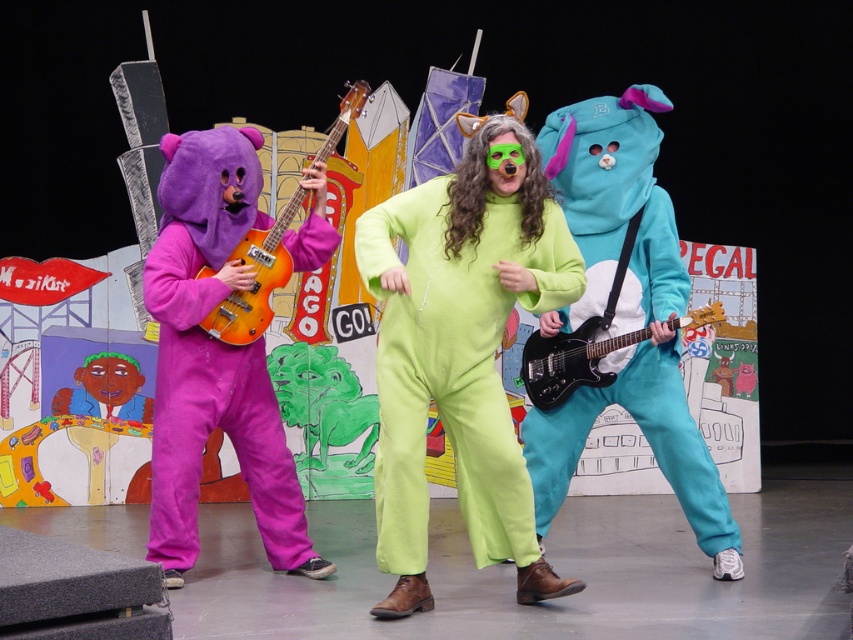
Question: Can you confirm if green fleece jumpsuit at center is positioned below purple fleece bear at left?

Choices:
 (A) yes
 (B) no

Answer: (A)

Question: Which point is closer to the camera?

Choices:
 (A) purple fleece bear at left
 (B) black glossy electric guitar at center
 (C) green fleece jumpsuit at center

Answer: (C)

Question: Which object is the farthest from the purple fleece bear at left?

Choices:
 (A) orange glossy guitar at left
 (B) black glossy electric guitar at center

Answer: (B)

Question: Can you confirm if green fleece jumpsuit at center is positioned to the left of purple fleece bear at left?

Choices:
 (A) no
 (B) yes

Answer: (A)

Question: Estimate the real-world distances between objects in this image. Which object is farther from the green fleece jumpsuit at center?

Choices:
 (A) purple fleece bear at left
 (B) black glossy electric guitar at center
 (C) teal plush onesie at center
 (D) orange glossy guitar at left

Answer: (D)

Question: Does green fleece jumpsuit at center come in front of black glossy electric guitar at center?

Choices:
 (A) yes
 (B) no

Answer: (A)